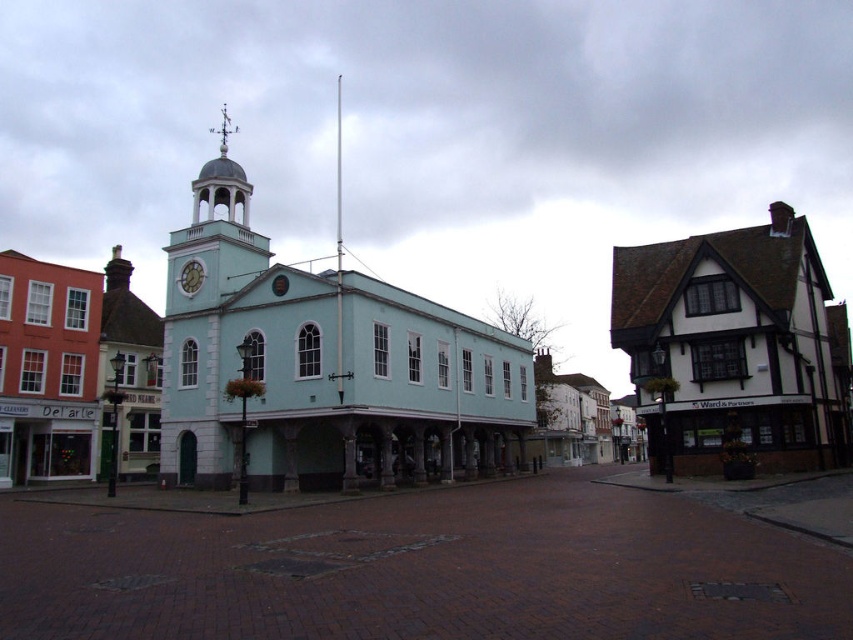
Question: Which point is farther to the camera?

Choices:
 (A) polished silver dome at upper center
 (B) teal painted clock at center

Answer: (A)

Question: In this image, where is light blue painted wood at center located relative to white wood-framed building at right?

Choices:
 (A) right
 (B) left

Answer: (B)

Question: Can you confirm if white wood-framed building at right is thinner than teal painted clock at center?

Choices:
 (A) yes
 (B) no

Answer: (B)

Question: Which object appears closest to the camera in this image?

Choices:
 (A) polished silver dome at upper center
 (B) brick pavement at center
 (C) white wood-framed building at right

Answer: (B)

Question: Does brick pavement at center appear over polished silver dome at upper center?

Choices:
 (A) no
 (B) yes

Answer: (A)

Question: Which is nearer to the light blue painted wood at center?

Choices:
 (A) white wood-framed building at right
 (B) teal painted clock at center
 (C) polished silver dome at upper center

Answer: (C)